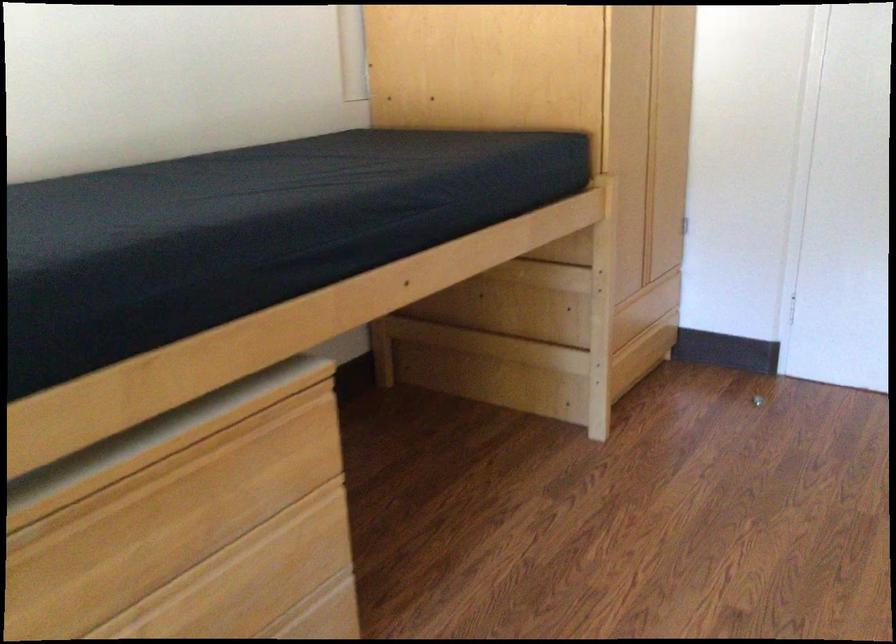
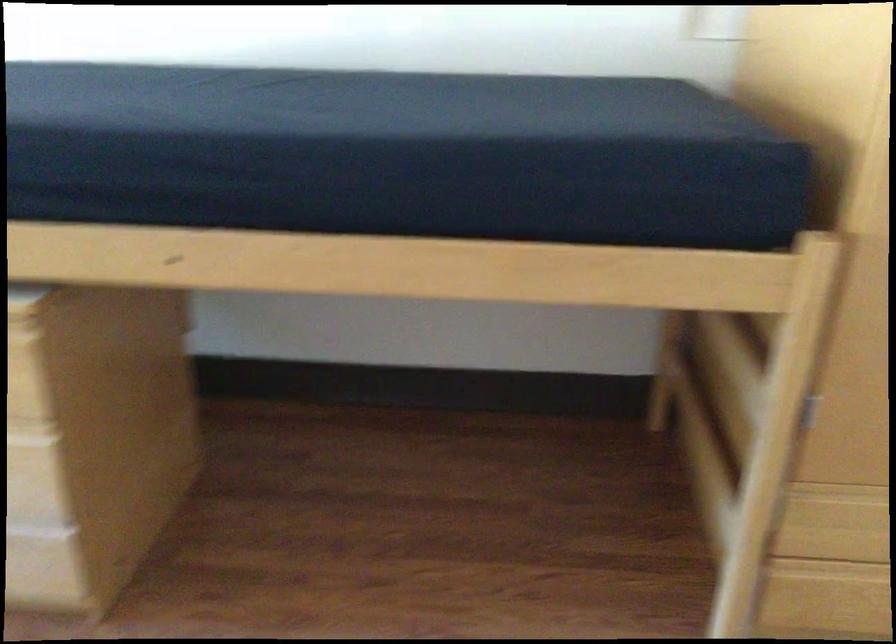
Locate, in the second image, the point that corresponds to pixel 403 361 in the first image.

(673, 408)